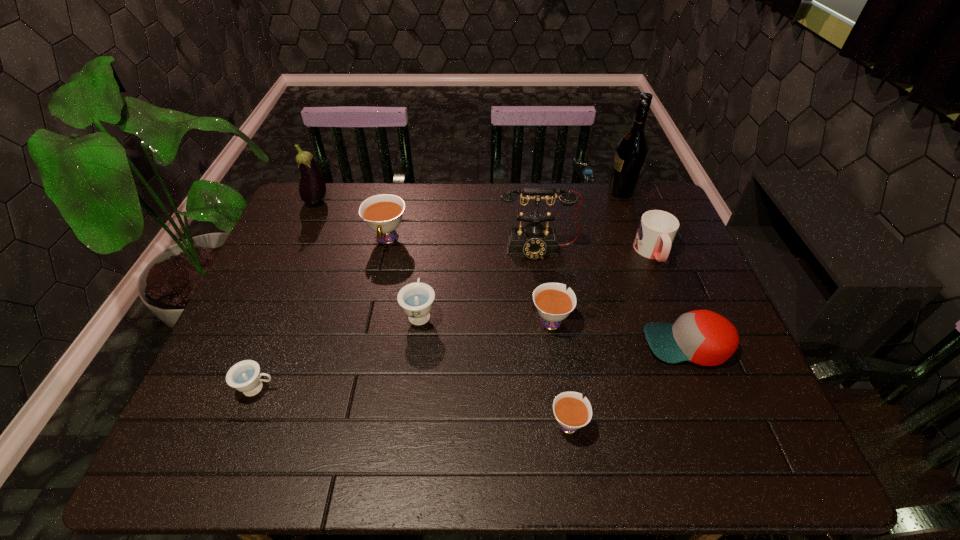
What are the coordinates of `free location located on the side of the eighth object from right to left with the handle` in the screenshot? It's located at (381, 268).

The width and height of the screenshot is (960, 540). What are the coordinates of `free space located 0.240m on the side of the mug with the handle` in the screenshot? It's located at (687, 339).

Locate an element on the screen. Image resolution: width=960 pixels, height=540 pixels. vacant space positioned 0.060m on the side of the second biggest white teacup with the handle is located at coordinates (545, 285).

Find the location of `vacant area situated on the side of the second biggest white teacup with the handle`. vacant area situated on the side of the second biggest white teacup with the handle is located at coordinates (541, 260).

Identify the location of blank area located on the side of the second biggest white teacup with the handle. The width and height of the screenshot is (960, 540). (545, 287).

The width and height of the screenshot is (960, 540). In order to click on vacant space positioned at the brim of the baseball cap in this screenshot , I will do tap(486, 345).

Locate an element on the screen. free space located at the brim of the baseball cap is located at coordinates (602, 345).

This screenshot has width=960, height=540. Find the location of `blank area located at the brim of the baseball cap`. blank area located at the brim of the baseball cap is located at coordinates (491, 345).

Image resolution: width=960 pixels, height=540 pixels. Find the location of `free location located 0.200m on the side of the seventh object from right to left with the handle`. free location located 0.200m on the side of the seventh object from right to left with the handle is located at coordinates (428, 246).

I want to click on vacant area situated 0.060m on the side of the seventh object from right to left with the handle, so click(x=424, y=279).